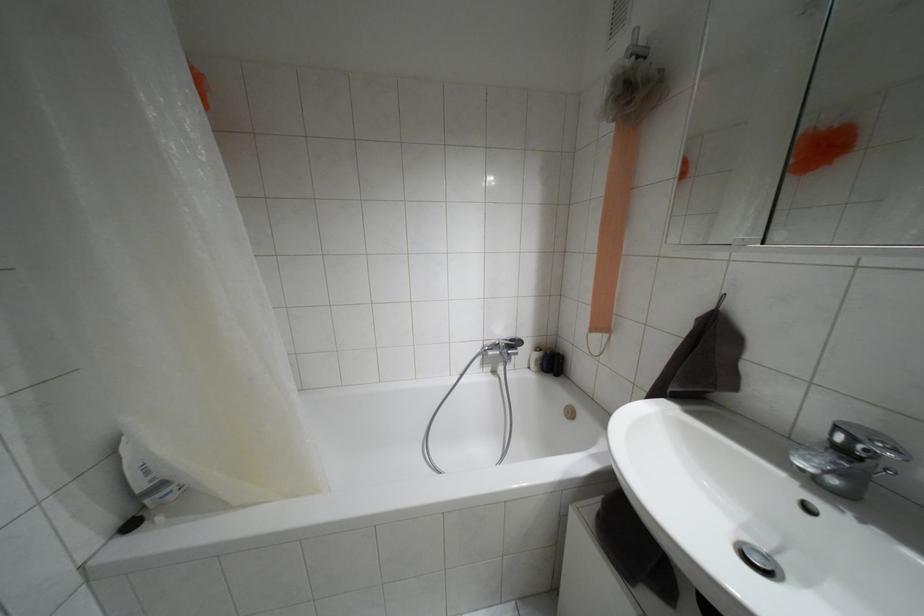
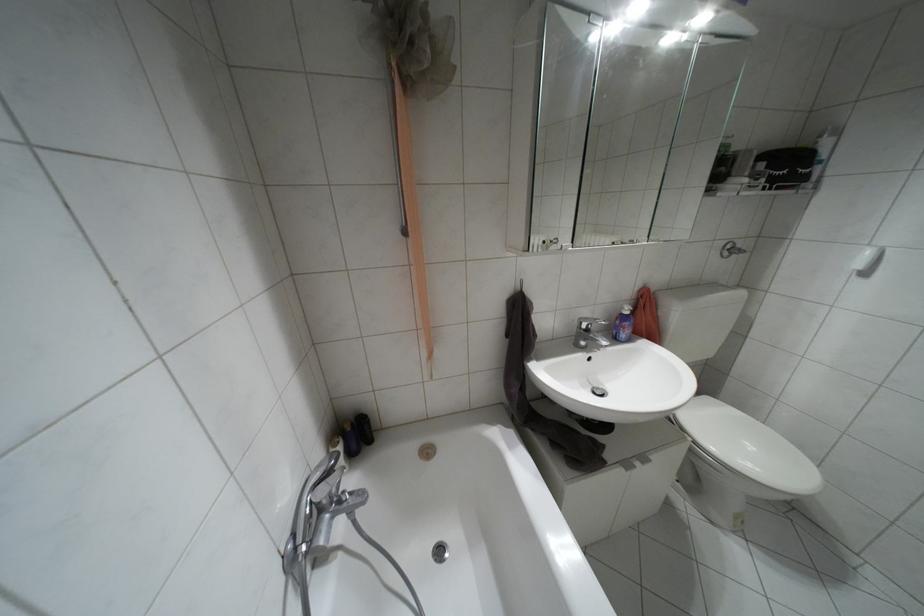
Locate, in the second image, the point that corresponds to the point at 843,450 in the first image.

(587, 330)